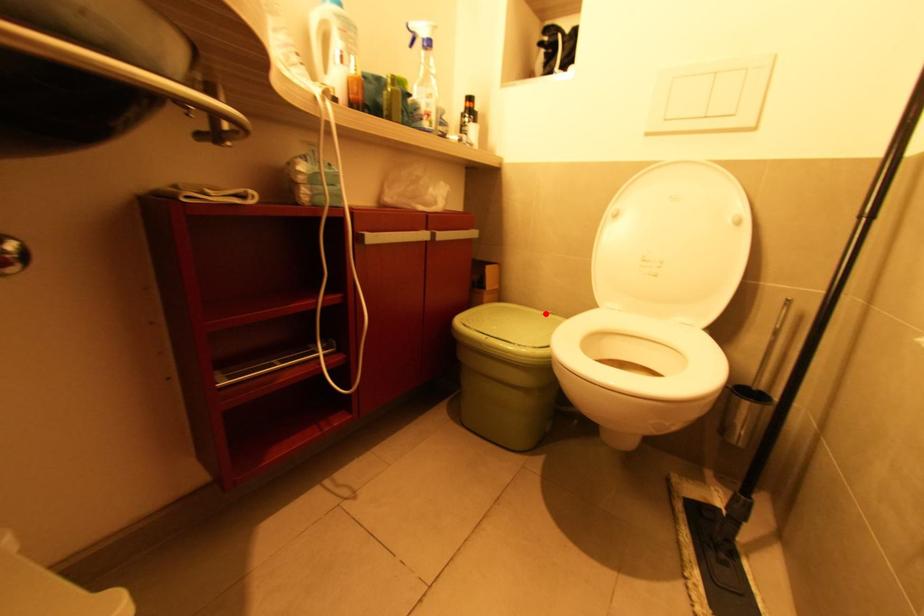
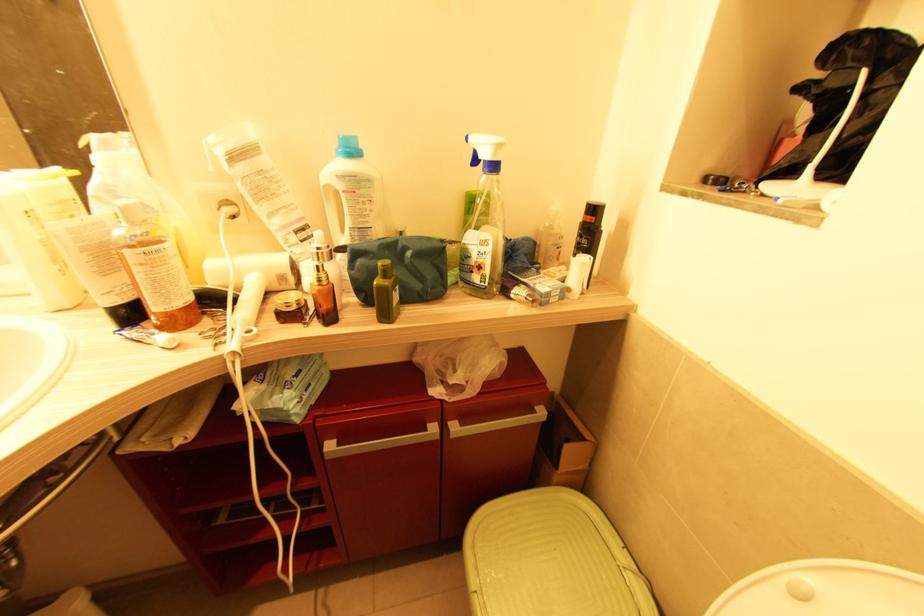
The point at the highlighted location is marked in the first image. Where is the corresponding point in the second image?

(626, 570)